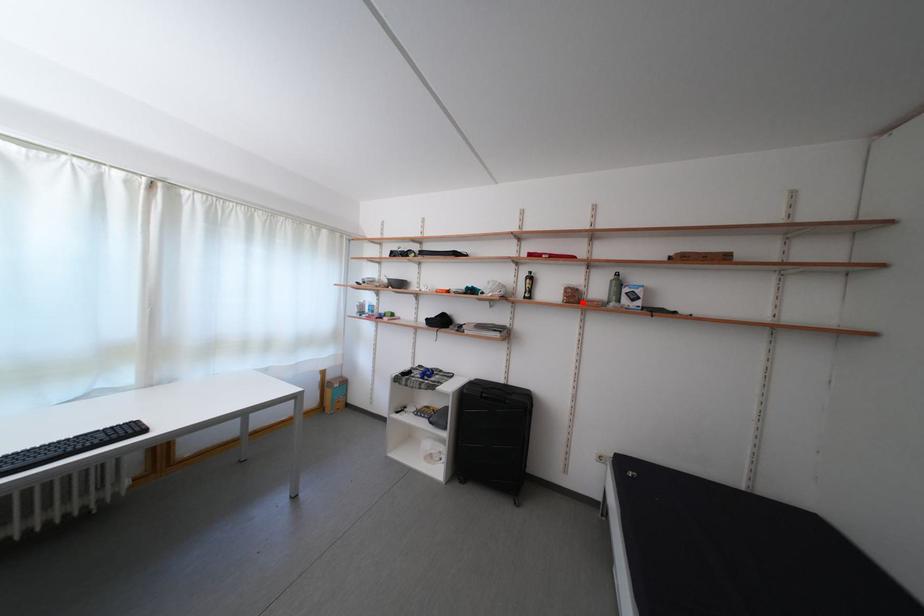
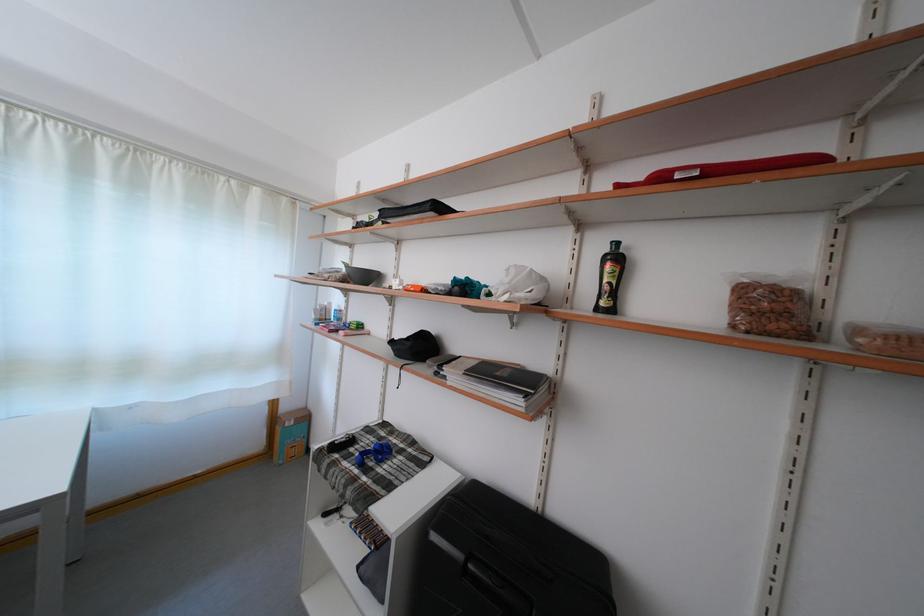
In the second image, find the point that corresponds to the highlighted location in the first image.

(782, 321)